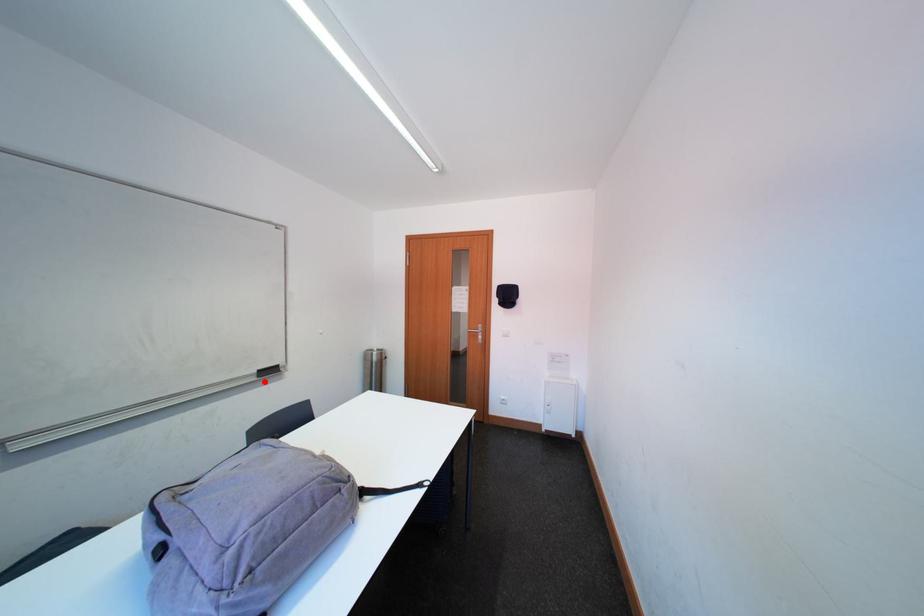
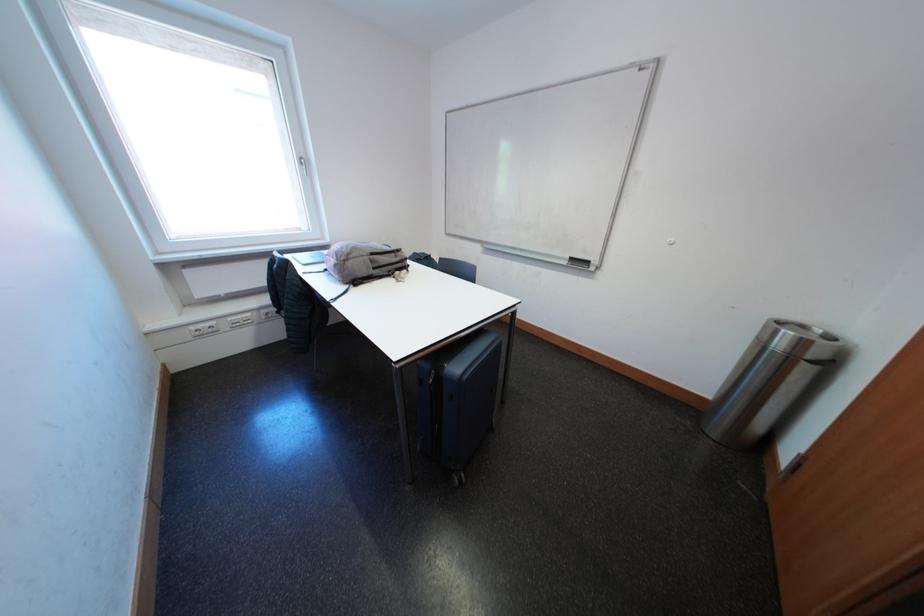
Locate, in the second image, the point that corresponds to the highlighted location in the first image.

(575, 267)